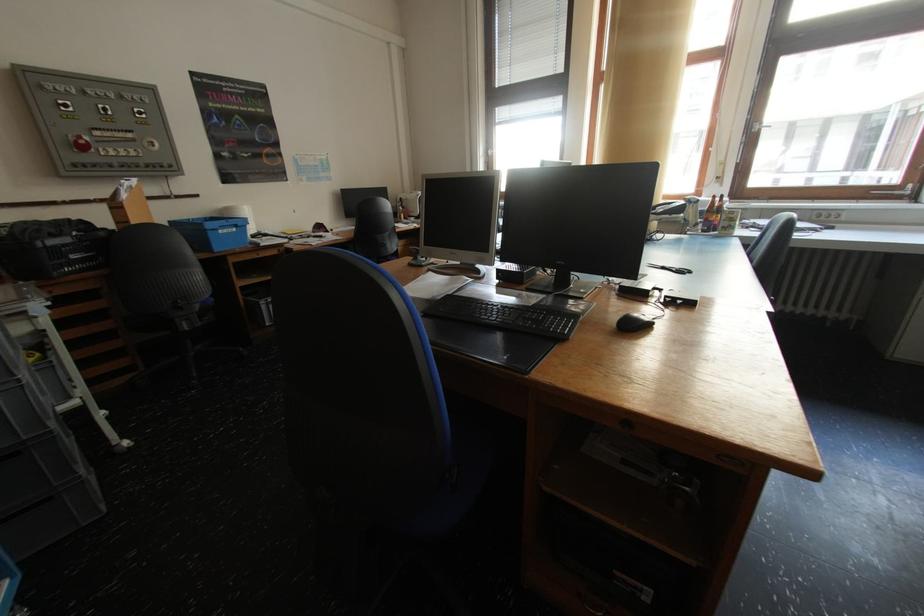
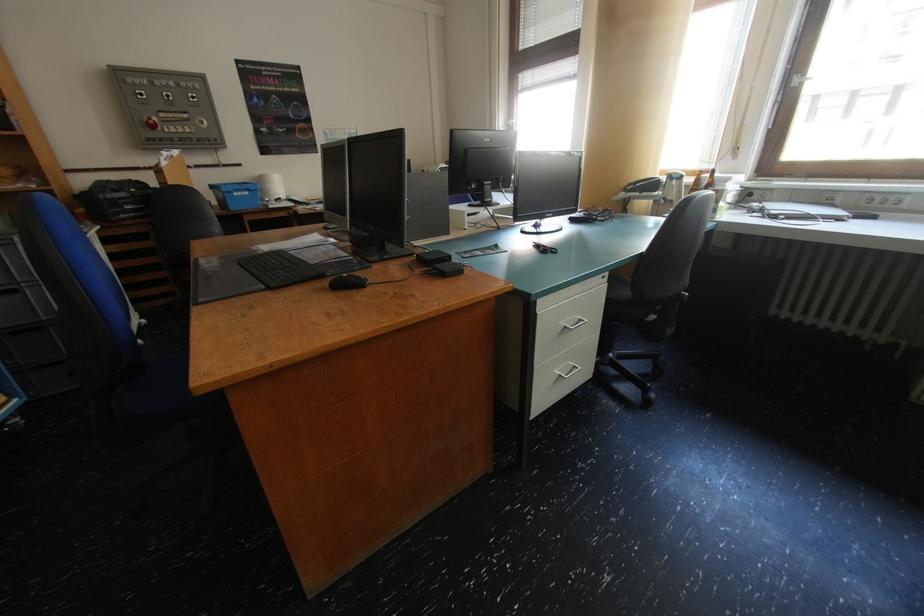
Question: In a continuous first-person perspective shot, in which direction is the camera moving?

Choices:
 (A) Left
 (B) Right
 (C) Forward
 (D) Backward

Answer: (B)